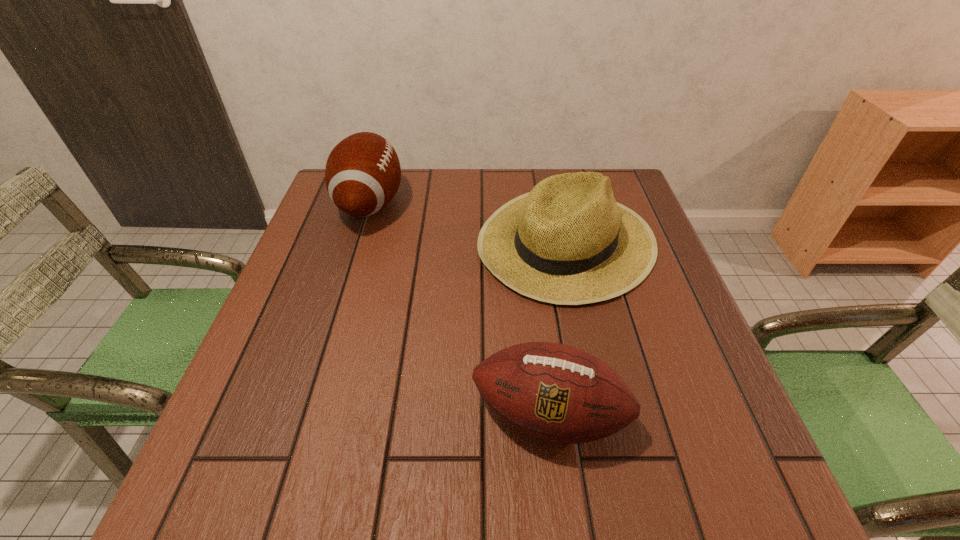
Locate an element on the screen. free spot between the nearest object and the sunhat is located at coordinates (558, 328).

Where is `vacant space that is in between the nearest object and the farther football (American)`? Image resolution: width=960 pixels, height=540 pixels. vacant space that is in between the nearest object and the farther football (American) is located at coordinates (459, 309).

Find the location of `vacant space that's between the left football (American) and the sunhat`. vacant space that's between the left football (American) and the sunhat is located at coordinates (468, 222).

Locate an element on the screen. The image size is (960, 540). vacant area that lies between the right football (American) and the tallest object is located at coordinates (459, 309).

Locate an element on the screen. This screenshot has height=540, width=960. free space between the tallest object and the sunhat is located at coordinates (468, 222).

The image size is (960, 540). In order to click on free point between the nearest object and the farther football (American) in this screenshot , I will do `click(459, 309)`.

The width and height of the screenshot is (960, 540). I want to click on vacant space that's between the right football (American) and the left football (American), so click(x=459, y=309).

At what (x,y) coordinates should I click in order to perform the action: click on free space between the nearest object and the leftmost object. Please return your answer as a coordinate pair (x, y). This screenshot has height=540, width=960. Looking at the image, I should click on (459, 309).

Identify the location of free space that is in between the sunhat and the left football (American). (468, 222).

Where is `unoccupied area between the tallest object and the sunhat`? This screenshot has width=960, height=540. unoccupied area between the tallest object and the sunhat is located at coordinates (468, 222).